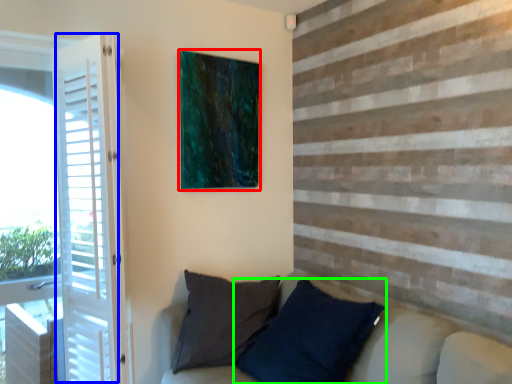
Question: Which object is the closest to the picture frame (highlighted by a red box)? Choose among these: screen door (highlighted by a blue box) or pillow (highlighted by a green box).

Choices:
 (A) screen door
 (B) pillow

Answer: (A)